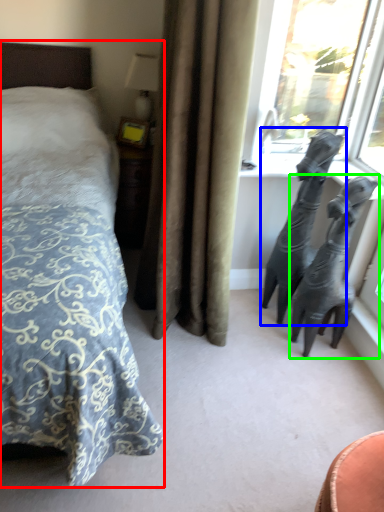
Question: Based on their relative distances, which object is farther from bed (highlighted by a red box)? Choose from animal (highlighted by a blue box) and bronze sculpture (highlighted by a green box).

Choices:
 (A) animal
 (B) bronze sculpture

Answer: (B)